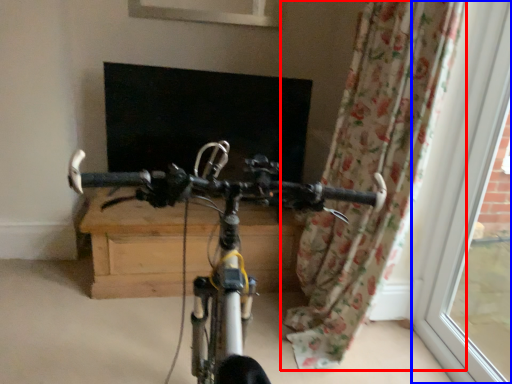
Question: Among these objects, which one is nearest to the camera, curtain (highlighted by a red box) or window frame (highlighted by a blue box)?

Choices:
 (A) curtain
 (B) window frame

Answer: (B)